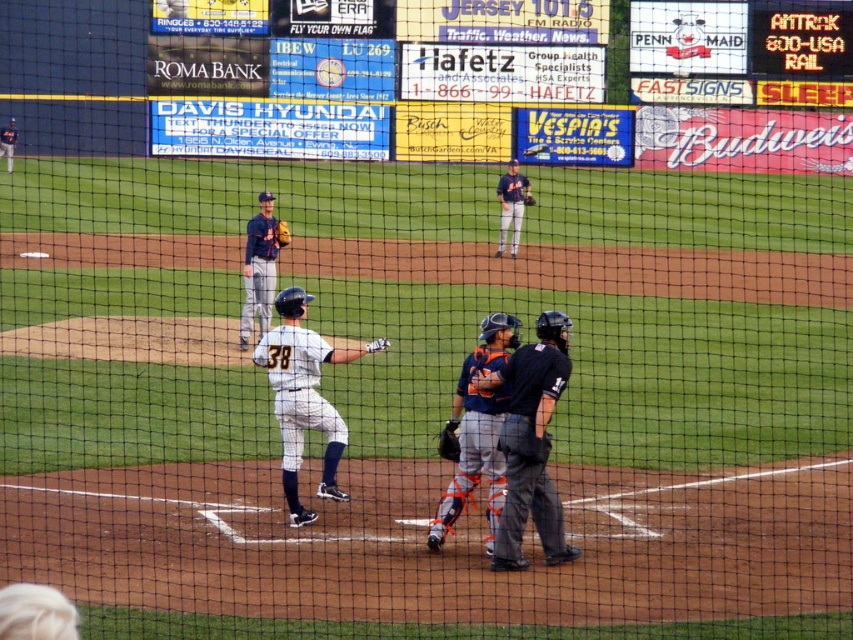
Question: Which is farther from the matte gray uniform at center?

Choices:
 (A) orange mesh catcher at center
 (B) dark blue uniform at upper center
 (C) dark blue leather glove at center
 (D) blue uniformed player at center

Answer: (D)

Question: Is orange mesh catcher at center to the left of orange leather glove at upper center from the viewer's perspective?

Choices:
 (A) yes
 (B) no

Answer: (A)

Question: Estimate the real-world distances between objects in this image. Which object is farther from the orange mesh catcher at center?

Choices:
 (A) black leather baseball glove at center
 (B) black matte umpire at center
 (C) white uniform at home plate

Answer: (C)

Question: Among these points, which one is farthest from the camera?

Choices:
 (A) (527, 148)
 (B) (526, 195)
 (C) (457, 436)
 (D) (283, 332)

Answer: (A)

Question: Can you confirm if matte black bat at center is positioned above yellow leather glove at center?

Choices:
 (A) no
 (B) yes

Answer: (B)

Question: Can you confirm if matte black bat at center is bigger than orange leather glove at upper center?

Choices:
 (A) yes
 (B) no

Answer: (B)